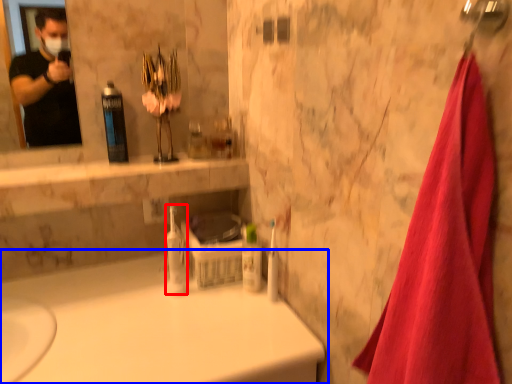
Question: Among these objects, which one is nearest to the camera, mouthwash (highlighted by a red box) or bathtub (highlighted by a blue box)?

Choices:
 (A) mouthwash
 (B) bathtub

Answer: (B)